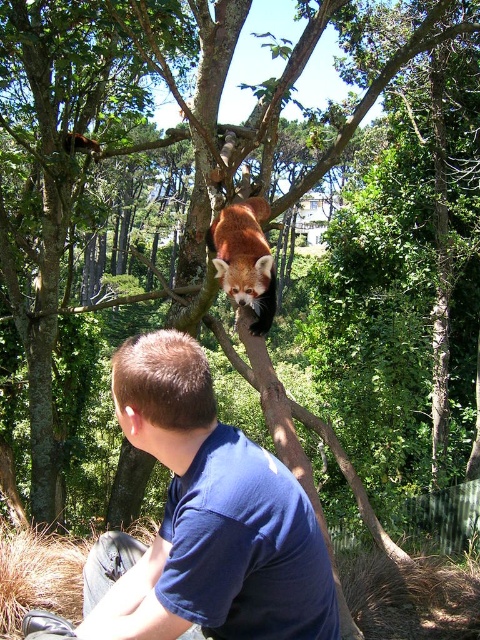
Between blue cotton shirt at lower center and fluffy reddish-brown animal at upper center, which one is positioned higher?

fluffy reddish-brown animal at upper center is higher up.

Can you confirm if blue cotton shirt at lower center is positioned to the left of fluffy reddish-brown animal at upper center?

Correct, you'll find blue cotton shirt at lower center to the left of fluffy reddish-brown animal at upper center.

In order to click on blue cotton shirt at lower center in this screenshot , I will do `click(204, 518)`.

Where is `blue cotton shirt at lower center`? Image resolution: width=480 pixels, height=640 pixels. blue cotton shirt at lower center is located at coordinates (204, 518).